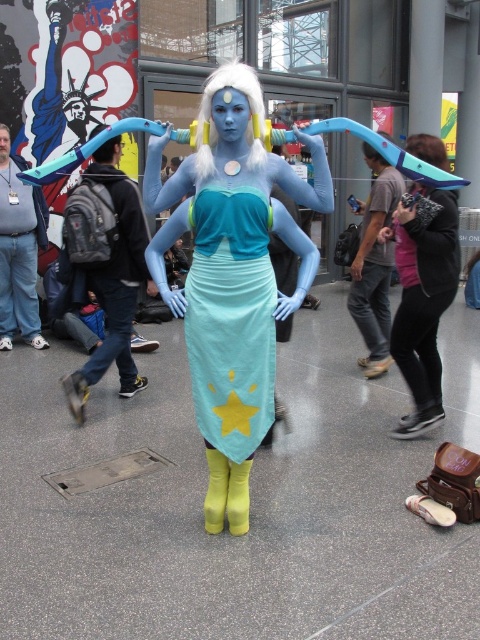
Question: Which of these objects is positioned closest to the matte black backpack at left?

Choices:
 (A) white matte wig at upper center
 (B) matte blue costume at center
 (C) brushed metal water at bottle left

Answer: (B)

Question: Which object is positioned closest to the brushed metal water at bottle left?

Choices:
 (A) matte blue costume at center
 (B) light blue satin dress at center

Answer: (A)

Question: Among these points, which one is farthest from the camera?

Choices:
 (A) (229, 298)
 (B) (424, 156)
 (C) (95, 275)

Answer: (C)

Question: Is matte black backpack at left smaller than black leather jacket at right?

Choices:
 (A) no
 (B) yes

Answer: (A)

Question: Can you confirm if matte blue costume at center is positioned above white matte wig at upper center?

Choices:
 (A) yes
 (B) no

Answer: (B)

Question: Where is matte blue costume at center located in relation to black leather jacket at right in the image?

Choices:
 (A) right
 (B) left

Answer: (B)